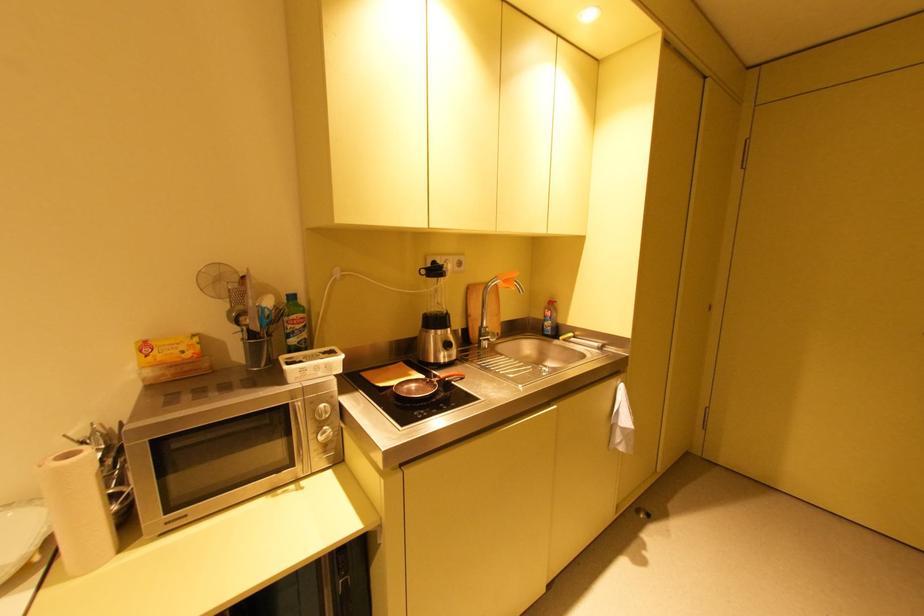
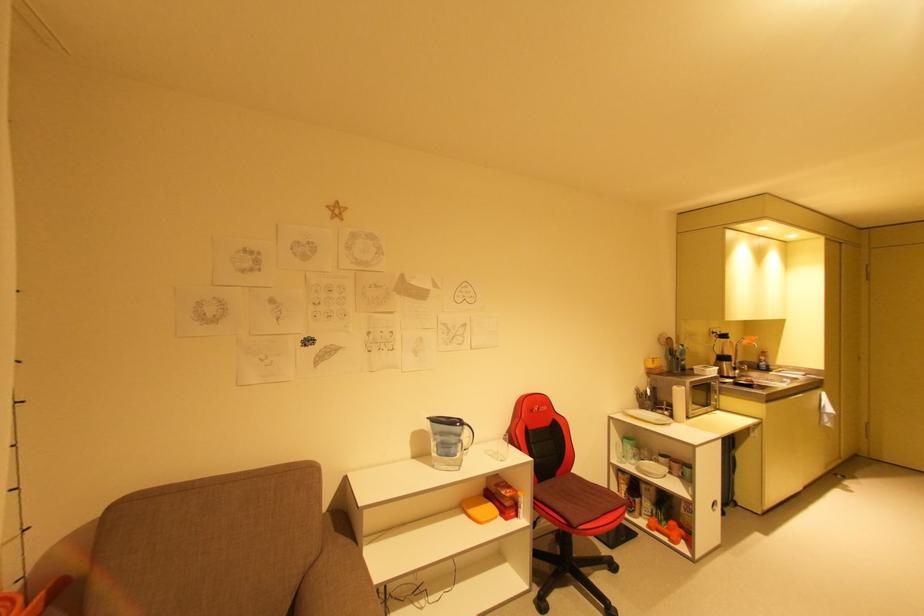
The point at (x=508, y=282) is marked in the first image. Where is the corresponding point in the second image?

(756, 341)